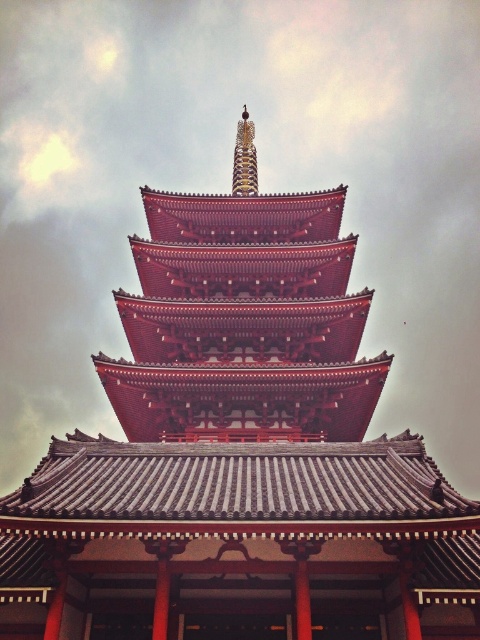
I want to click on shiny red pagoda at center, so click(243, 323).

At what (x,y) coordinates should I click in order to perform the action: click on shiny red pagoda at center. Please return your answer as a coordinate pair (x, y). The image size is (480, 640). Looking at the image, I should click on (243, 323).